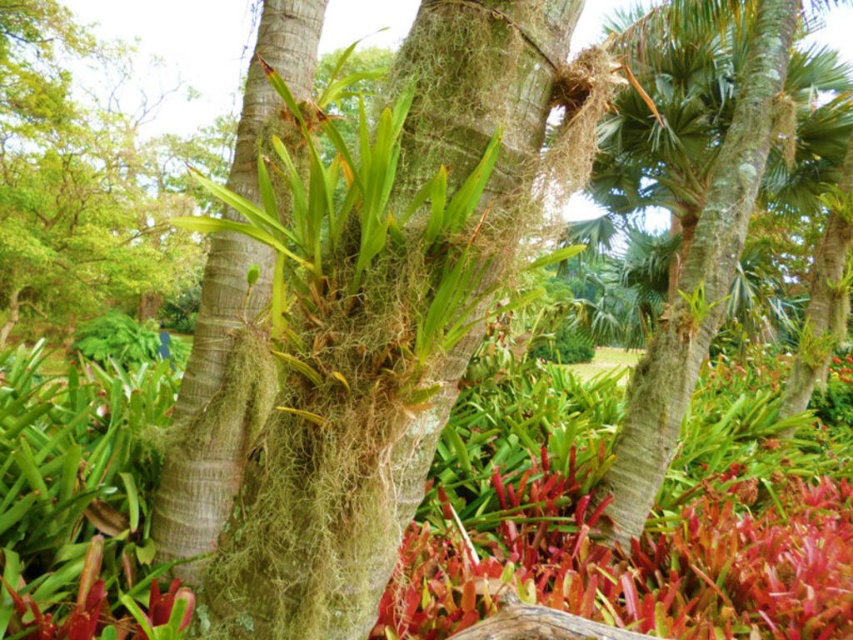
Question: Can you confirm if vivid red leaves at lower center is positioned to the left of green mossy bark tree trunk at center?

Choices:
 (A) no
 (B) yes

Answer: (A)

Question: Estimate the real-world distances between objects in this image. Which object is farther from the vivid red leaves at lower center?

Choices:
 (A) green mossy tree at center
 (B) green mossy bark tree trunk at center

Answer: (A)

Question: Can you confirm if green mossy tree at center is smaller than green mossy bark tree trunk at center?

Choices:
 (A) no
 (B) yes

Answer: (A)

Question: Can you confirm if vivid red leaves at lower center is positioned to the right of green mossy bark tree trunk at center?

Choices:
 (A) yes
 (B) no

Answer: (A)

Question: Which point appears farthest from the camera in this image?

Choices:
 (A) (196, 557)
 (B) (402, 596)

Answer: (A)

Question: Which object is positioned farthest from the green mossy bark tree trunk at center?

Choices:
 (A) green mossy tree at center
 (B) vivid red leaves at lower center

Answer: (A)